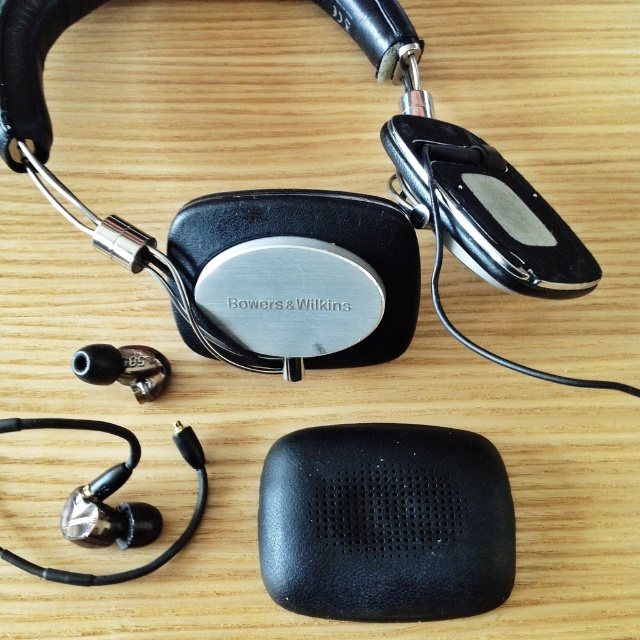
Question: Among these objects, which one is farthest from the camera?

Choices:
 (A) black matte speaker at center
 (B) metallic silver earphone at lower left

Answer: (B)

Question: Which point is closer to the camera taking this photo?

Choices:
 (A) (138, 346)
 (B) (305, 449)

Answer: (B)

Question: Is the position of black matte speaker at center more distant than that of metallic silver earphone at lower left?

Choices:
 (A) yes
 (B) no

Answer: (B)

Question: Is the position of black matte speaker at center less distant than that of metallic silver earphone at lower left?

Choices:
 (A) yes
 (B) no

Answer: (A)

Question: From the image, what is the correct spatial relationship of black matte speaker at center in relation to metallic silver earphone at lower left?

Choices:
 (A) right
 (B) left

Answer: (A)